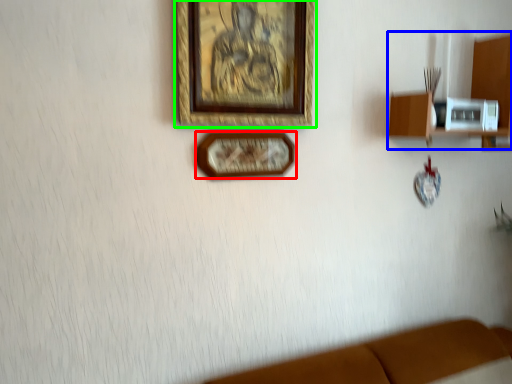
Question: Considering the real-world distances, which object is closest to picture frame (highlighted by a red box)? shelf (highlighted by a blue box) or picture frame (highlighted by a green box).

Choices:
 (A) shelf
 (B) picture frame

Answer: (B)